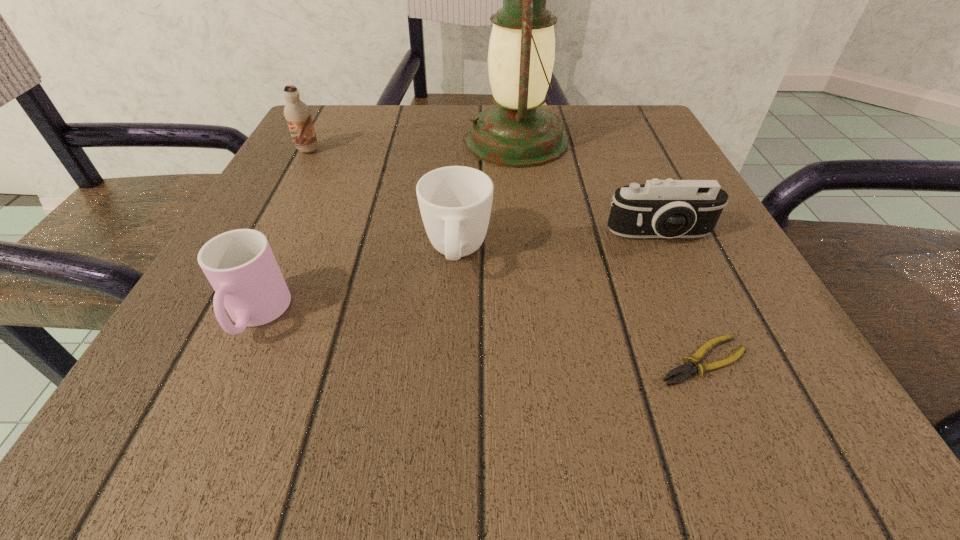
Locate an element on the screen. This screenshot has width=960, height=540. free space that satisfies the following two spatial constraints: 1. with the handle on the side of the pliers; 2. on the right side of the right cup is located at coordinates (451, 361).

Locate an element on the screen. The image size is (960, 540). free spot that satisfies the following two spatial constraints: 1. with the light compartment facing forward on the tallest object; 2. on the right side of the pliers is located at coordinates (542, 361).

Identify the location of free space that satisfies the following two spatial constraints: 1. with the light compartment facing forward on the lantern; 2. with the handle on the side of the left cup. (537, 316).

Where is `blank area in the image that satisfies the following two spatial constraints: 1. with the light compartment facing forward on the tallest object; 2. with the handle on the side of the left cup`? The height and width of the screenshot is (540, 960). blank area in the image that satisfies the following two spatial constraints: 1. with the light compartment facing forward on the tallest object; 2. with the handle on the side of the left cup is located at coordinates (537, 316).

Find the location of `vacant space that satisfies the following two spatial constraints: 1. with the handle on the side of the shortest object; 2. on the left side of the left cup`. vacant space that satisfies the following two spatial constraints: 1. with the handle on the side of the shortest object; 2. on the left side of the left cup is located at coordinates [235, 361].

At what (x,y) coordinates should I click in order to perform the action: click on vacant region that satisfies the following two spatial constraints: 1. with the light compartment facing forward on the shortest object; 2. on the left side of the lantern. Please return your answer as a coordinate pair (x, y). This screenshot has height=540, width=960. Looking at the image, I should click on (542, 361).